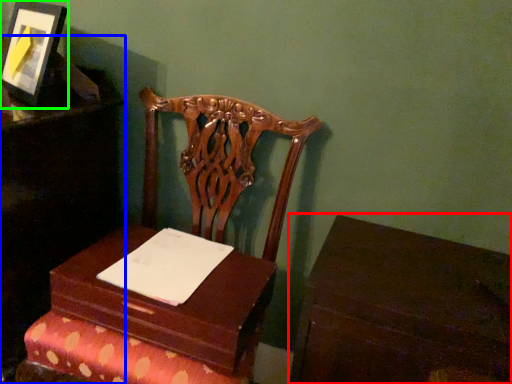
Question: Which object is positioned farthest from table (highlighted by a red box)? Select from furniture (highlighted by a blue box) and picture frame (highlighted by a green box).

Choices:
 (A) furniture
 (B) picture frame

Answer: (B)